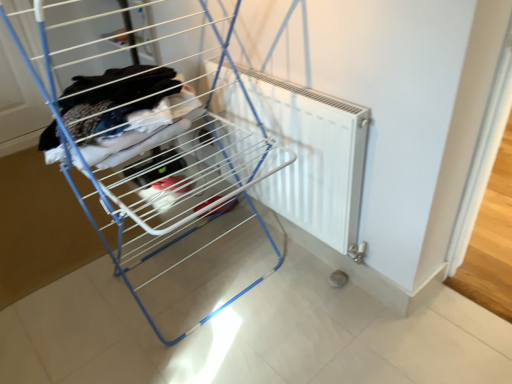
Question: Is white matte radiator at center inside the boundaries of white plastic radiator at center, or outside?

Choices:
 (A) inside
 (B) outside

Answer: (B)

Question: From the image's perspective, is white matte radiator at center located above or below white plastic radiator at center?

Choices:
 (A) below
 (B) above

Answer: (A)

Question: Considering the positions of white matte radiator at center and white plastic radiator at center in the image, is white matte radiator at center taller or shorter than white plastic radiator at center?

Choices:
 (A) tall
 (B) short

Answer: (B)

Question: From the image's perspective, is white plastic radiator at center positioned above or below white matte radiator at center?

Choices:
 (A) below
 (B) above

Answer: (B)

Question: Is white plastic radiator at center bigger or smaller than white matte radiator at center?

Choices:
 (A) small
 (B) big

Answer: (B)

Question: Relative to white matte radiator at center, is white plastic radiator at center in front or behind?

Choices:
 (A) front
 (B) behind

Answer: (A)

Question: Is point (144, 170) positioned closer to the camera than point (347, 205)?

Choices:
 (A) farther
 (B) closer

Answer: (A)